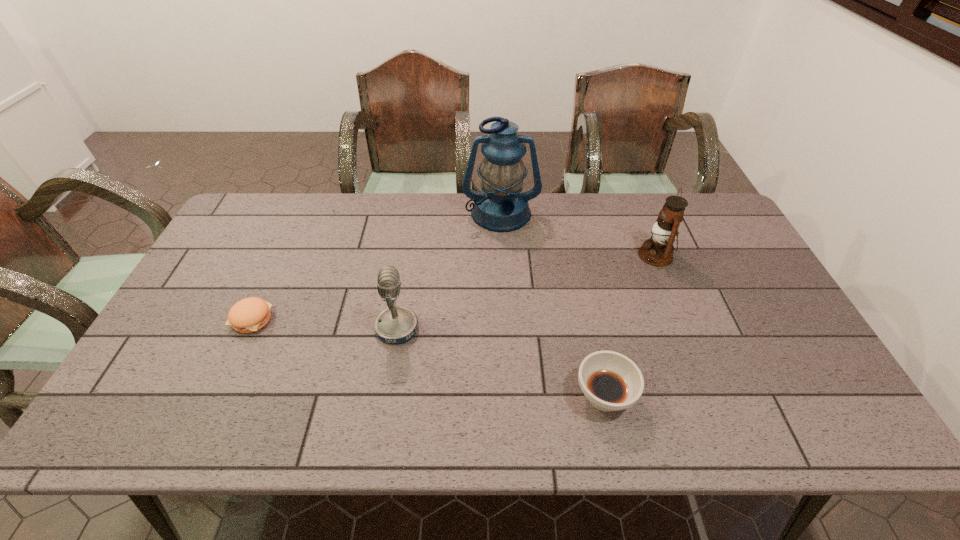
Image resolution: width=960 pixels, height=540 pixels. Find the location of `free space located 0.100m on the side of the nearer lantern, there is a wick adjustment knob`. free space located 0.100m on the side of the nearer lantern, there is a wick adjustment knob is located at coordinates (606, 255).

I want to click on free region located on the side of the nearer lantern, there is a wick adjustment knob, so click(x=541, y=255).

This screenshot has height=540, width=960. Identify the location of vacant area situated on the side of the nearer lantern, there is a wick adjustment knob. (606, 255).

At what (x,y) coordinates should I click in order to perform the action: click on vacant space situated 0.210m on the front-facing side of the microphone. Please return your answer as a coordinate pair (x, y). This screenshot has width=960, height=540. Looking at the image, I should click on (498, 328).

The width and height of the screenshot is (960, 540). Find the location of `blank space located on the left of the soup bowl`. blank space located on the left of the soup bowl is located at coordinates (411, 396).

Locate an element on the screen. vacant space located 0.400m on the back of the leftmost object is located at coordinates [x=300, y=214].

At what (x,y) coordinates should I click in order to perform the action: click on object positioned at the far edge. Please return your answer as a coordinate pair (x, y). Looking at the image, I should click on (501, 206).

Identify the location of object located in the near edge section of the desktop. (610, 381).

Where is `object that is positioned at the left edge`? The width and height of the screenshot is (960, 540). object that is positioned at the left edge is located at coordinates (248, 315).

Where is `vacant space at the far edge of the desktop`? The width and height of the screenshot is (960, 540). vacant space at the far edge of the desktop is located at coordinates (331, 204).